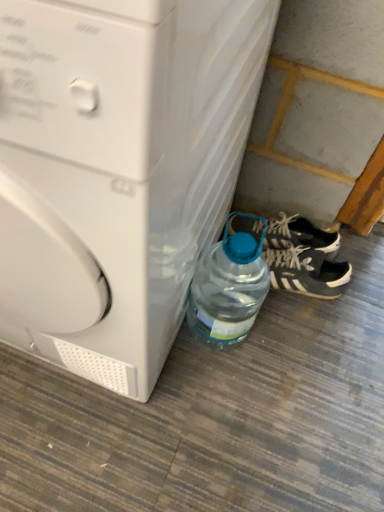
The height and width of the screenshot is (512, 384). Describe the element at coordinates (303, 232) in the screenshot. I see `black matte sneakers at lower right` at that location.

This screenshot has width=384, height=512. Describe the element at coordinates (118, 170) in the screenshot. I see `white plastic washing machine at lower left` at that location.

Measure the distance between white plastic washing machine at lower left and camera.

white plastic washing machine at lower left is 10.63 inches from camera.

The image size is (384, 512). In order to click on transparent plastic bottle at lower right in this screenshot , I will do `click(229, 286)`.

Considering the points (324, 237) and (313, 266), which point is in front, point (324, 237) or point (313, 266)?

The point (313, 266) is more forward.

Is black matte sneakers at lower right turned away from black suede sneakers at lower right?

No, black matte sneakers at lower right is not facing away from black suede sneakers at lower right.

Image resolution: width=384 pixels, height=512 pixels. Find the location of `sneakers above the black suede sneakers at lower right (from a real-world perspective)`. sneakers above the black suede sneakers at lower right (from a real-world perspective) is located at coordinates (303, 232).

Would you consider black matte sneakers at lower right to be distant from black suede sneakers at lower right?

No, black matte sneakers at lower right is not far away from black suede sneakers at lower right.

In the scene shown: From a real-world perspective, does black suede sneakers at lower right sit lower than white plastic washing machine at lower left?

Yes, from a real-world perspective, black suede sneakers at lower right is under white plastic washing machine at lower left.

Is white plastic washing machine at lower left surrounded by black suede sneakers at lower right?

Definitely not — white plastic washing machine at lower left is not inside black suede sneakers at lower right.

Is point (328, 284) positioned after point (183, 60)?

Yes.

Which point is more forward, (210, 265) or (330, 234)?

Positioned in front is point (210, 265).

Which is more to the left, transparent plastic bottle at lower right or black matte sneakers at lower right?

transparent plastic bottle at lower right.

Consider the image. Can you confirm if transparent plastic bottle at lower right is taller than black matte sneakers at lower right?

Yes, transparent plastic bottle at lower right is taller than black matte sneakers at lower right.

How much distance is there between transparent plastic bottle at lower right and black matte sneakers at lower right?

A distance of 9.53 inches exists between transparent plastic bottle at lower right and black matte sneakers at lower right.

Are white plastic washing machine at lower left and black matte sneakers at lower right making contact?

No, white plastic washing machine at lower left is not next to black matte sneakers at lower right.

Can you confirm if white plastic washing machine at lower left is taller than black matte sneakers at lower right?

Indeed, white plastic washing machine at lower left has a greater height compared to black matte sneakers at lower right.

Is white plastic washing machine at lower left outside of black matte sneakers at lower right?

Indeed, white plastic washing machine at lower left is completely outside black matte sneakers at lower right.

Considering the sizes of objects white plastic washing machine at lower left and black matte sneakers at lower right in the image provided, who is smaller, white plastic washing machine at lower left or black matte sneakers at lower right?

Smaller between the two is black matte sneakers at lower right.

Does black matte sneakers at lower right turn towards white plastic washing machine at lower left?

Yes, black matte sneakers at lower right faces towards white plastic washing machine at lower left.

Between black matte sneakers at lower right and white plastic washing machine at lower left, which one appears on the right side from the viewer's perspective?

black matte sneakers at lower right.

From a real-world perspective, is white plastic washing machine at lower left physically located above or below transparent plastic bottle at lower right?

white plastic washing machine at lower left is situated higher than transparent plastic bottle at lower right in the real world.

Can you confirm if white plastic washing machine at lower left is taller than transparent plastic bottle at lower right?

Yes, white plastic washing machine at lower left is taller than transparent plastic bottle at lower right.

From the image's perspective, which one is positioned higher, white plastic washing machine at lower left or transparent plastic bottle at lower right?

white plastic washing machine at lower left, from the image's perspective.

You are a GUI agent. You are given a task and a screenshot of the screen. Output one action in this format:
    pyautogui.click(x=<x>, y=<y>)
    Task: Click on the washing machine on the left of transparent plastic bottle at lower right
    Image resolution: width=384 pixels, height=512 pixels.
    Given the screenshot: What is the action you would take?
    pyautogui.click(x=118, y=170)

Is transparent plastic bottle at lower right taller than white plastic washing machine at lower left?

In fact, transparent plastic bottle at lower right may be shorter than white plastic washing machine at lower left.

Considering the positions of point (195, 295) and point (156, 19), is point (195, 295) closer or farther from the camera than point (156, 19)?

Point (195, 295) is positioned farther from the camera compared to point (156, 19).

This screenshot has height=512, width=384. Identify the location of footwear located in front of the black matte sneakers at lower right. (306, 271).

The width and height of the screenshot is (384, 512). I want to click on footwear that is under the white plastic washing machine at lower left (from a real-world perspective), so click(x=306, y=271).

Which object lies nearer to the anchor point white plastic washing machine at lower left, black matte sneakers at lower right or transparent plastic bottle at lower right?

Based on the image, transparent plastic bottle at lower right appears to be nearer to white plastic washing machine at lower left.

Based on their spatial positions, is black suede sneakers at lower right or black matte sneakers at lower right further from white plastic washing machine at lower left?

black matte sneakers at lower right is positioned further to the anchor white plastic washing machine at lower left.

From the image, which object appears to be nearer to transparent plastic bottle at lower right, white plastic washing machine at lower left or black matte sneakers at lower right?

Among the two, white plastic washing machine at lower left is located nearer to transparent plastic bottle at lower right.

Estimate the real-world distances between objects in this image. Which object is further from black matte sneakers at lower right, transparent plastic bottle at lower right or black suede sneakers at lower right?

transparent plastic bottle at lower right is further to black matte sneakers at lower right.

Which object lies nearer to the anchor point black suede sneakers at lower right, black matte sneakers at lower right or white plastic washing machine at lower left?

black matte sneakers at lower right is closer to black suede sneakers at lower right.

Based on their spatial positions, is black matte sneakers at lower right or transparent plastic bottle at lower right further from black suede sneakers at lower right?

Among the two, transparent plastic bottle at lower right is located further to black suede sneakers at lower right.

Which object lies nearer to the anchor point black suede sneakers at lower right, white plastic washing machine at lower left or black matte sneakers at lower right?

black matte sneakers at lower right lies closer to black suede sneakers at lower right than the other object.

Based on their spatial positions, is transparent plastic bottle at lower right or white plastic washing machine at lower left further from black suede sneakers at lower right?

white plastic washing machine at lower left lies further to black suede sneakers at lower right than the other object.

The image size is (384, 512). Identify the location of footwear between white plastic washing machine at lower left and black matte sneakers at lower right from front to back. (306, 271).

Image resolution: width=384 pixels, height=512 pixels. Find the location of `footwear positioned between transparent plastic bottle at lower right and black matte sneakers at lower right from near to far`. footwear positioned between transparent plastic bottle at lower right and black matte sneakers at lower right from near to far is located at coordinates (306, 271).

Where is `bottle between white plastic washing machine at lower left and black matte sneakers at lower right from front to back`? The height and width of the screenshot is (512, 384). bottle between white plastic washing machine at lower left and black matte sneakers at lower right from front to back is located at coordinates (229, 286).

The image size is (384, 512). In order to click on bottle between white plastic washing machine at lower left and black suede sneakers at lower right from front to back in this screenshot , I will do `click(229, 286)`.